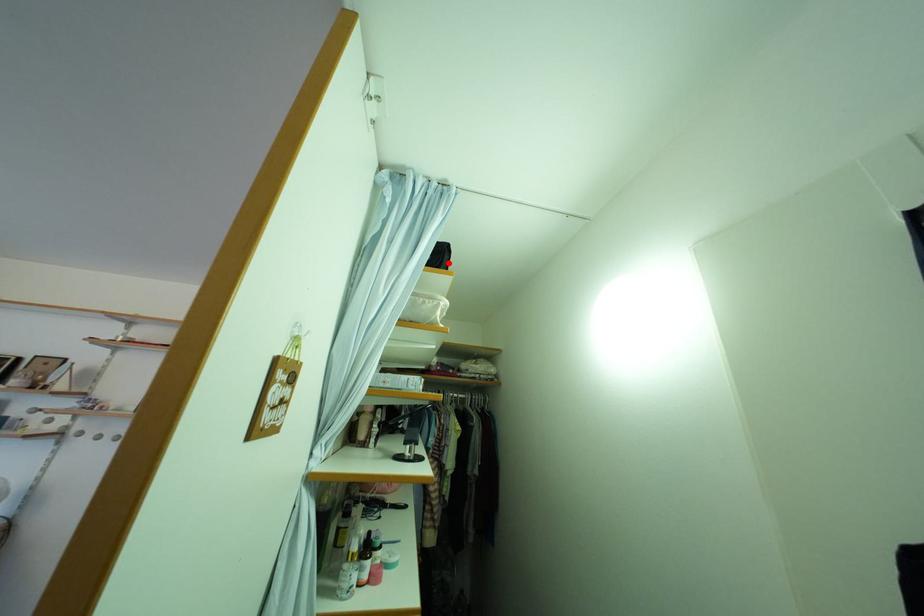
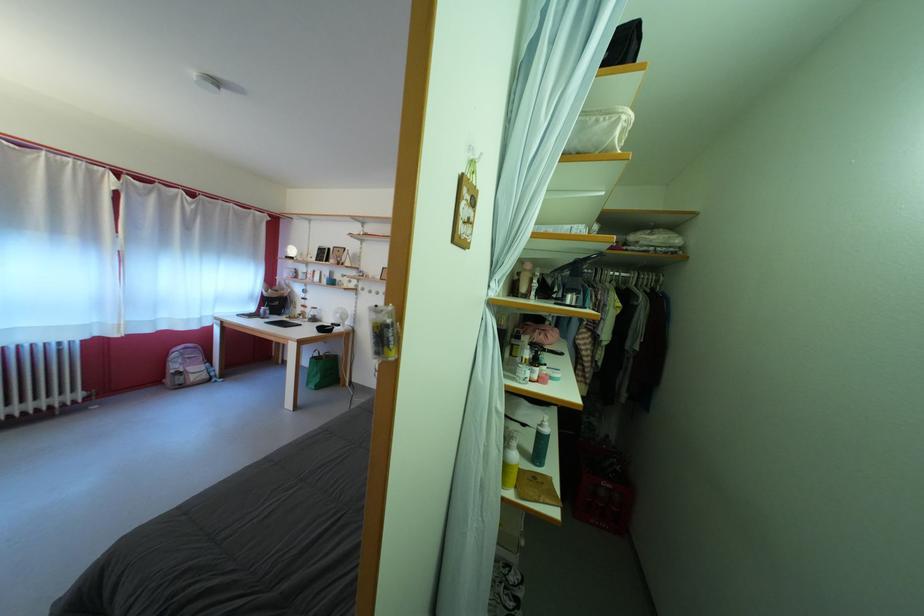
The point at the highlighted location is marked in the first image. Where is the corresponding point in the second image?

(631, 54)